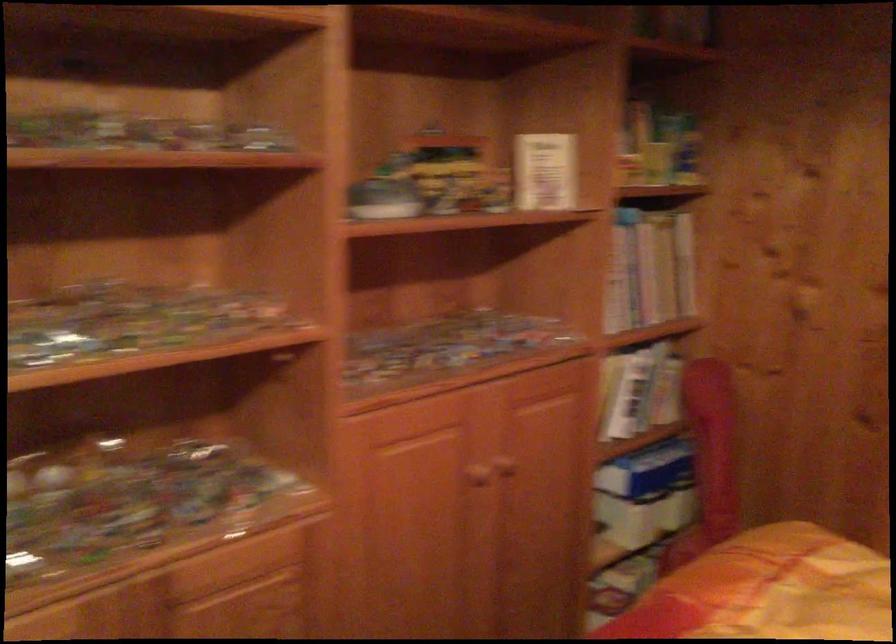
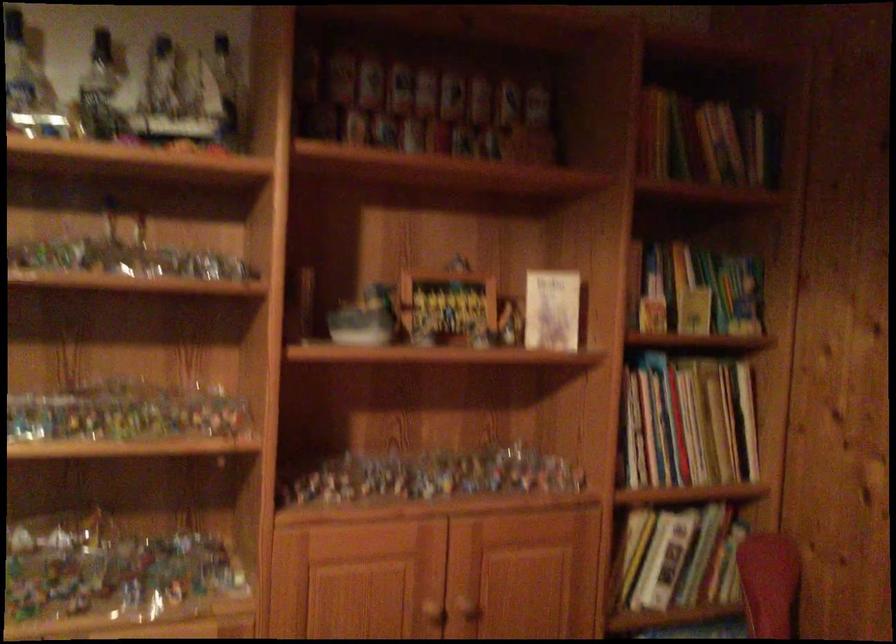
Question: What movement of the cameraman would produce the second image?

Choices:
 (A) Left
 (B) Right
 (C) Forward
 (D) Backward

Answer: (B)